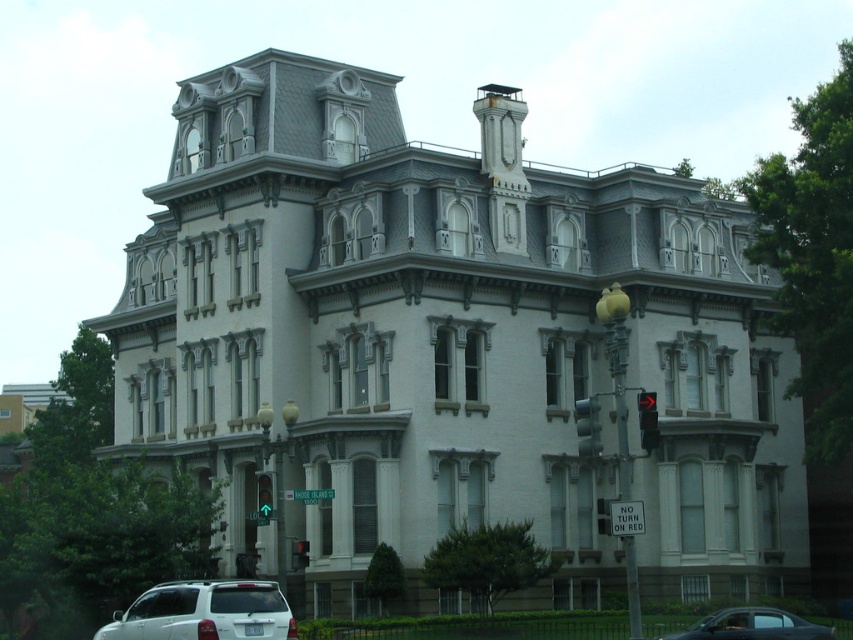
Question: Observing the image, what is the correct spatial positioning of metallic gray sedan at lower right in reference to black glass traffic light at right?

Choices:
 (A) left
 (B) right

Answer: (B)

Question: Which point is closer to the camera taking this photo?

Choices:
 (A) [778, 625]
 (B) [653, 417]

Answer: (B)

Question: Does green glass traffic light at center have a smaller size compared to metallic traffic light at lower right?

Choices:
 (A) yes
 (B) no

Answer: (A)

Question: Which of the following is the closest to the observer?

Choices:
 (A) metallic traffic light at lower right
 (B) white matte suv at lower left

Answer: (B)

Question: Which object is farther from the camera taking this photo?

Choices:
 (A) black glass traffic light at right
 (B) red glass traffic light at lower center
 (C) green glass traffic light at lower left

Answer: (B)

Question: Is green glass traffic light at lower left behind red glass traffic light at lower center?

Choices:
 (A) yes
 (B) no

Answer: (B)